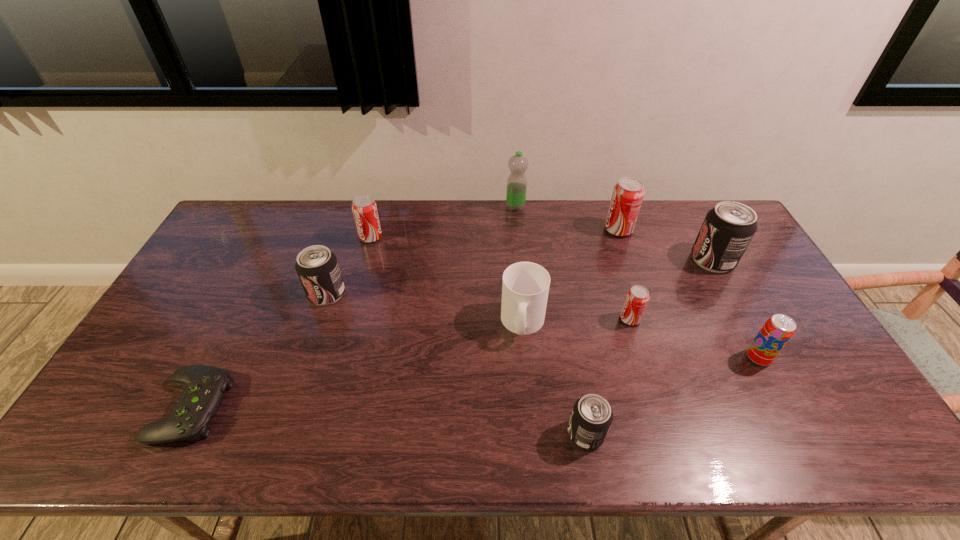
Identify the location of water bottle at the far edge. The width and height of the screenshot is (960, 540). (517, 182).

The height and width of the screenshot is (540, 960). Find the location of `soda can situated at the near edge`. soda can situated at the near edge is located at coordinates (591, 417).

What are the coordinates of `control that is at the near edge` in the screenshot? It's located at (205, 386).

Locate an element on the screen. The height and width of the screenshot is (540, 960). object located at the left edge is located at coordinates (205, 386).

The width and height of the screenshot is (960, 540). Find the location of `object that is at the near left corner`. object that is at the near left corner is located at coordinates (205, 386).

Where is `vacant space at the far edge of the desktop`? vacant space at the far edge of the desktop is located at coordinates (487, 237).

In the image, there is a desktop. Where is `free space at the near edge`? The image size is (960, 540). free space at the near edge is located at coordinates (791, 422).

In the image, there is a desktop. Where is `free space at the right edge`? This screenshot has height=540, width=960. free space at the right edge is located at coordinates (755, 314).

Find the location of a particular element. The image size is (960, 540). free space at the near right corner of the desktop is located at coordinates (864, 454).

Where is `vacant point located between the mug and the eighth farthest object`? The image size is (960, 540). vacant point located between the mug and the eighth farthest object is located at coordinates click(640, 340).